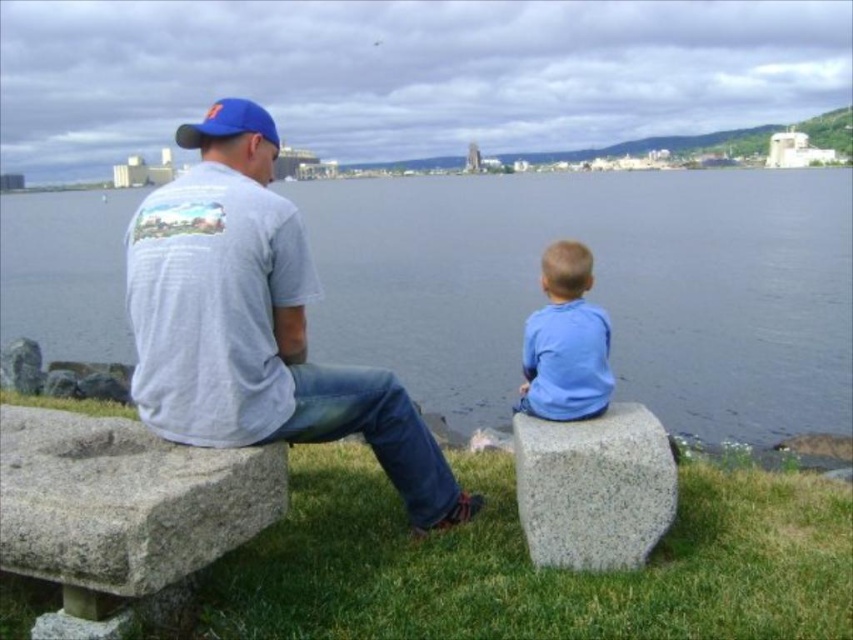
Which is in front, point (109, 429) or point (532, 364)?

Positioned in front is point (109, 429).

Does granite bench at lower left have a smaller size compared to light blue cotton shirt at right?

No.

Is point (169, 552) in front of point (535, 406)?

Yes, it is in front of point (535, 406).

Locate an element on the screen. The image size is (853, 640). granite bench at lower left is located at coordinates (122, 508).

Is point (390, 280) positioned in front of point (254, 108)?

No, (390, 280) is further to viewer.

Which is in front, point (718, 180) or point (270, 116)?

Point (270, 116)

The image size is (853, 640). What are the coordinates of `blue water at center` in the screenshot? It's located at (598, 289).

Is point (508, 336) closer to camera compared to point (637, 557)?

That is False.

Measure the distance between point [70,321] and camera.

Point [70,321] is 24.15 meters away from camera.

Identify the location of blue water at center. The image size is (853, 640). (598, 289).